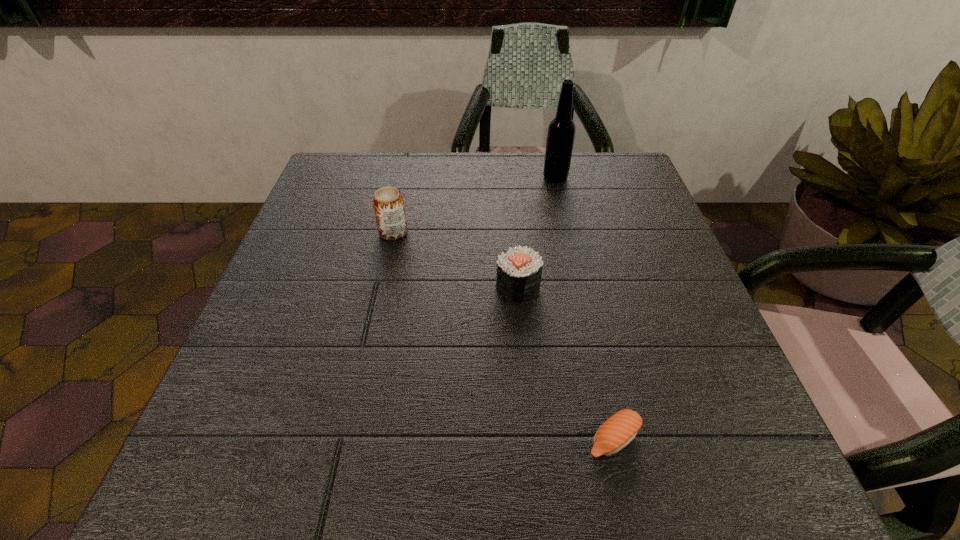
In the image, there is a desktop. Identify the location of free space at the far right corner. This screenshot has height=540, width=960. (617, 165).

At what (x,y) coordinates should I click in order to perform the action: click on vacant region between the farther sushi and the tallest object. Please return your answer as a coordinate pair (x, y). Looking at the image, I should click on (537, 232).

The width and height of the screenshot is (960, 540). What are the coordinates of `free area in between the leftmost object and the right sushi` in the screenshot? It's located at (503, 336).

I want to click on vacant point located between the tallest object and the beer can, so click(x=474, y=205).

Locate an element on the screen. free space between the tallest object and the third tallest object is located at coordinates (537, 232).

Find the location of a particular element. The height and width of the screenshot is (540, 960). free spot between the farthest object and the second nearest object is located at coordinates (537, 232).

This screenshot has width=960, height=540. What are the coordinates of `vacant region between the right sushi and the beer bottle` in the screenshot? It's located at (585, 308).

Locate an element on the screen. This screenshot has height=540, width=960. free space between the beer bottle and the nearest object is located at coordinates (585, 308).

At what (x,y) coordinates should I click in order to perform the action: click on free space between the shortest object and the third nearest object. Please return your answer as a coordinate pair (x, y). Image resolution: width=960 pixels, height=540 pixels. Looking at the image, I should click on (503, 336).

The height and width of the screenshot is (540, 960). Identify the location of empty space between the third object from right to left and the nearer sushi. (565, 363).